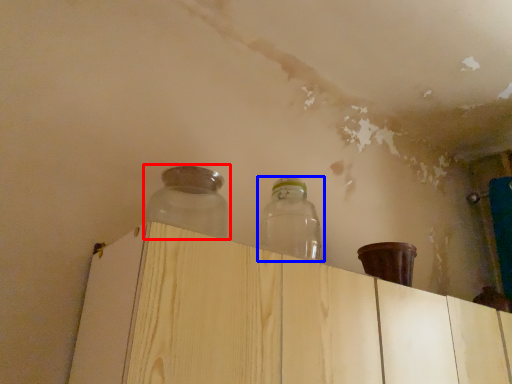
Question: Which object is further to the camera taking this photo, bottle (highlighted by a red box) or bottle (highlighted by a blue box)?

Choices:
 (A) bottle
 (B) bottle

Answer: (B)